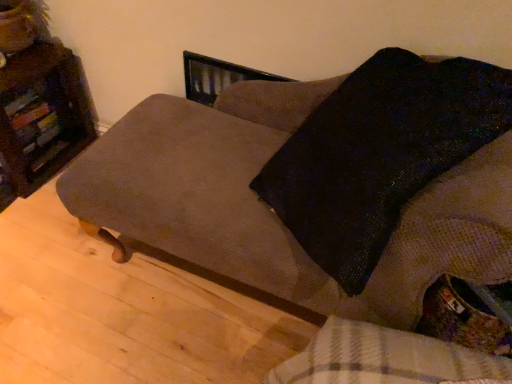
The width and height of the screenshot is (512, 384). I want to click on suede-like brown couch at center, so click(x=272, y=211).

Describe the element at coordinates (272, 211) in the screenshot. I see `suede-like brown couch at center` at that location.

Describe the element at coordinates (47, 112) in the screenshot. I see `wooden bookshelf at left` at that location.

What is the approximate width of wooden bookshelf at left?

The width of wooden bookshelf at left is 16.58 inches.

Measure the distance between point (34, 53) and camera.

Point (34, 53) and camera are 4.98 feet apart from each other.

I want to click on wooden bookshelf at left, so click(x=47, y=112).

Identify the location of suede-like brown couch at center. (272, 211).

Between wooden bookshelf at left and suede-like brown couch at center, which one appears on the left side from the viewer's perspective?

Positioned to the left is wooden bookshelf at left.

Is the position of wooden bookshelf at left less distant than that of suede-like brown couch at center?

No, the depth of wooden bookshelf at left is greater than that of suede-like brown couch at center.

Does point (93, 126) come closer to viewer compared to point (193, 247)?

No, it is behind (193, 247).

From the image's perspective, between wooden bookshelf at left and suede-like brown couch at center, which one is located above?

wooden bookshelf at left is shown above in the image.

Looking at this image, from a real-world perspective, does wooden bookshelf at left sit lower than suede-like brown couch at center?

Yes, from a real-world perspective, wooden bookshelf at left is below suede-like brown couch at center.

Between wooden bookshelf at left and suede-like brown couch at center, which one has larger width?

Wider between the two is suede-like brown couch at center.

Can you confirm if wooden bookshelf at left is shorter than suede-like brown couch at center?

Correct, wooden bookshelf at left is not as tall as suede-like brown couch at center.

Considering the relative sizes of wooden bookshelf at left and suede-like brown couch at center in the image provided, is wooden bookshelf at left smaller than suede-like brown couch at center?

Indeed, wooden bookshelf at left has a smaller size compared to suede-like brown couch at center.

Would you say wooden bookshelf at left is outside suede-like brown couch at center?

Yes, wooden bookshelf at left is not within suede-like brown couch at center.

Are wooden bookshelf at left and suede-like brown couch at center far apart?

wooden bookshelf at left is actually quite close to suede-like brown couch at center.

Is wooden bookshelf at left oriented away from suede-like brown couch at center?

No, wooden bookshelf at left is not facing the opposite direction of suede-like brown couch at center.

How far apart are wooden bookshelf at left and suede-like brown couch at center?

wooden bookshelf at left is 26.84 inches away from suede-like brown couch at center.

Find the location of a particular element. studio couch on the right of wooden bookshelf at left is located at coordinates (272, 211).

Is suede-like brown couch at center at the right side of wooden bookshelf at left?

Indeed, suede-like brown couch at center is positioned on the right side of wooden bookshelf at left.

Based on the photo, is the depth of suede-like brown couch at center greater than that of wooden bookshelf at left?

No, suede-like brown couch at center is in front of wooden bookshelf at left.

Does point (163, 206) appear closer or farther from the camera than point (8, 81)?

Point (163, 206) is positioned closer to the camera compared to point (8, 81).

From the image's perspective, which is below, suede-like brown couch at center or wooden bookshelf at left?

suede-like brown couch at center appears lower in the image.

From a real-world perspective, is suede-like brown couch at center physically below wooden bookshelf at left?

No, from a real-world perspective, suede-like brown couch at center is not below wooden bookshelf at left.

Is suede-like brown couch at center wider than wooden bookshelf at left?

Correct, the width of suede-like brown couch at center exceeds that of wooden bookshelf at left.

Is suede-like brown couch at center taller than wooden bookshelf at left?

Yes.

Which of these two, suede-like brown couch at center or wooden bookshelf at left, is smaller?

Smaller between the two is wooden bookshelf at left.

Would you say suede-like brown couch at center is inside or outside wooden bookshelf at left?

suede-like brown couch at center is located beyond the bounds of wooden bookshelf at left.

Is suede-like brown couch at center beside wooden bookshelf at left?

No, suede-like brown couch at center is not with wooden bookshelf at left.

Is suede-like brown couch at center oriented away from wooden bookshelf at left?

That's not correct — suede-like brown couch at center is not looking away from wooden bookshelf at left.

What's the angular difference between suede-like brown couch at center and wooden bookshelf at left's facing directions?

suede-like brown couch at center and wooden bookshelf at left are facing 0.624 degrees away from each other.

The height and width of the screenshot is (384, 512). Find the location of `studio couch below the wooden bookshelf at left (from the image's perspective)`. studio couch below the wooden bookshelf at left (from the image's perspective) is located at coordinates (272, 211).

Identify the location of studio couch on the right of the wooden bookshelf at left. (272, 211).

In the image, there is a wooden bookshelf at left. Where is `studio couch below it (from the image's perspective)`? This screenshot has width=512, height=384. studio couch below it (from the image's perspective) is located at coordinates (272, 211).